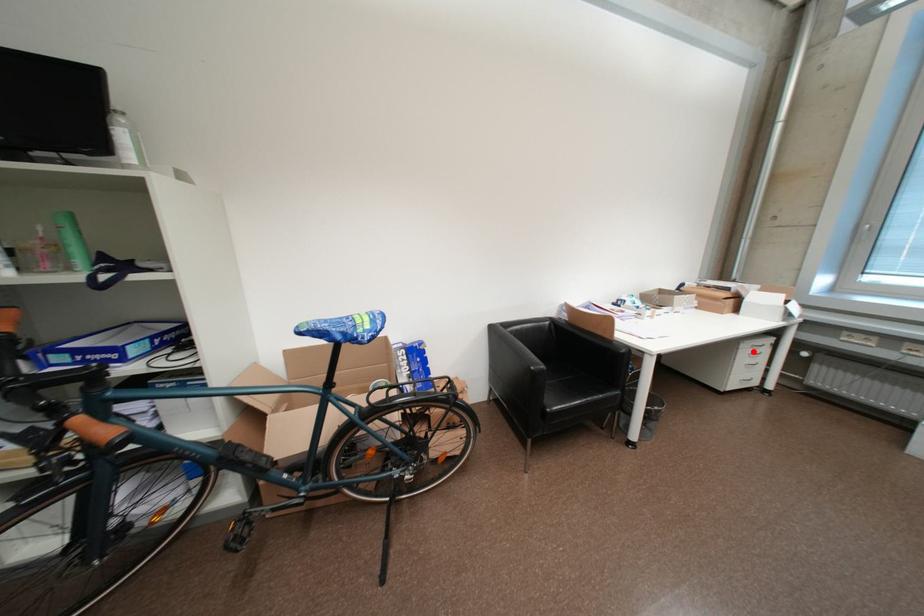
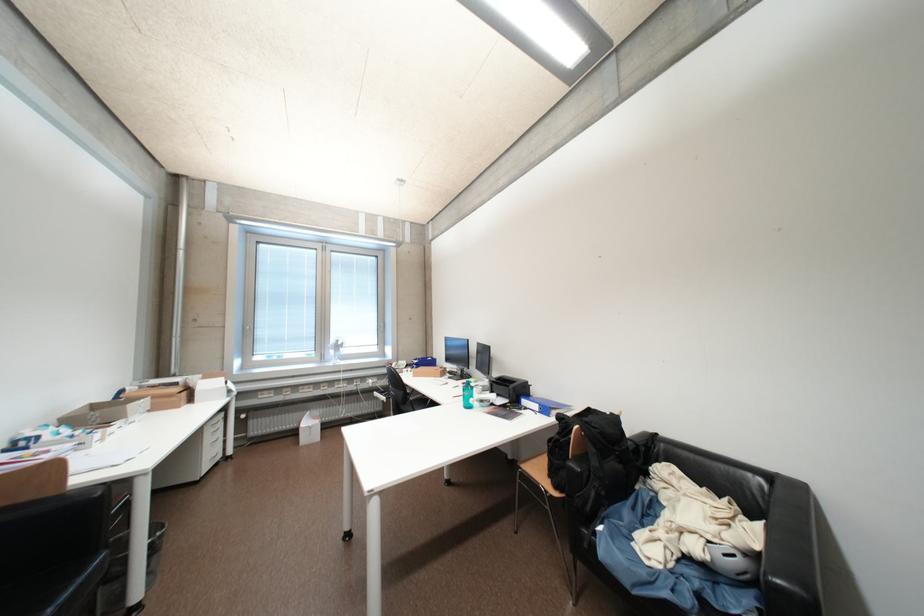
In the second image, find the point that corresponds to the highlighted location in the first image.

(216, 432)